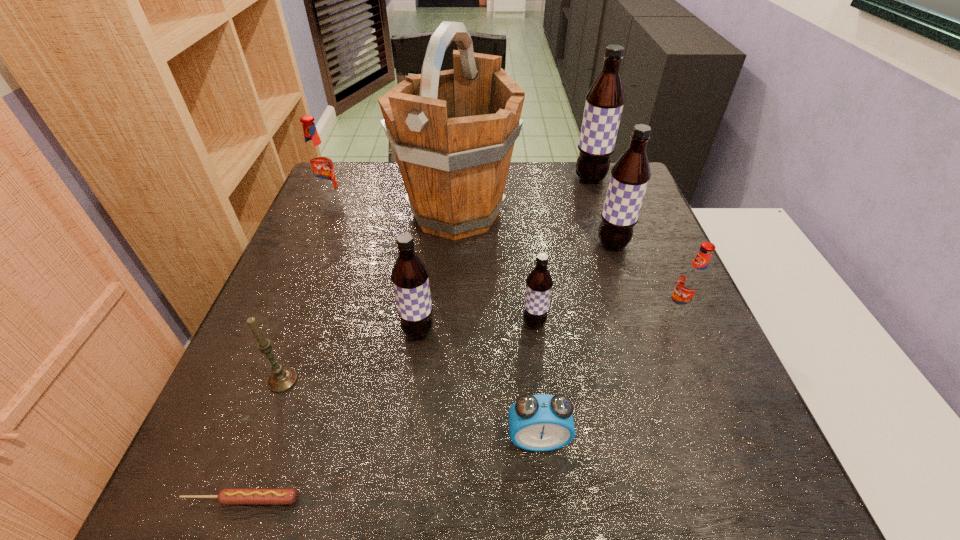
You are a GUI agent. You are given a task and a screenshot of the screen. Output one action in this format:
    pyautogui.click(x=<x>, y=<y>)
    Task: Click on the vacant space at the near right corner
    The width and height of the screenshot is (960, 540).
    Given the screenshot: What is the action you would take?
    pyautogui.click(x=764, y=472)

Where is `empty space between the right red root beer and the second shortest object`? The image size is (960, 540). empty space between the right red root beer and the second shortest object is located at coordinates (609, 375).

What are the coordinates of `vacant space that is in between the leftmost brown root beer and the ninth tallest object` in the screenshot? It's located at (478, 385).

The image size is (960, 540). Find the location of `unoccupied position between the eighth farthest object and the rightmost root beer`. unoccupied position between the eighth farthest object and the rightmost root beer is located at coordinates (481, 346).

Locate an element on the screen. vacant area that lies between the tallest object and the fourth nearest root beer is located at coordinates (534, 229).

Where is `free space that is in between the shortest object and the bigger red root beer`? The image size is (960, 540). free space that is in between the shortest object and the bigger red root beer is located at coordinates (285, 350).

Locate an element on the screen. This screenshot has height=540, width=960. empty location between the third nearest brown root beer and the fifth root beer from right to left is located at coordinates (516, 288).

This screenshot has width=960, height=540. In order to click on free space that is in between the candle and the leftmost brown root beer in this screenshot , I will do `click(350, 356)`.

What are the coordinates of `unoccupied area between the brown sausage and the smallest brown root beer` in the screenshot? It's located at (388, 411).

I want to click on unoccupied position between the third nearest object and the bigger red root beer, so click(x=306, y=291).